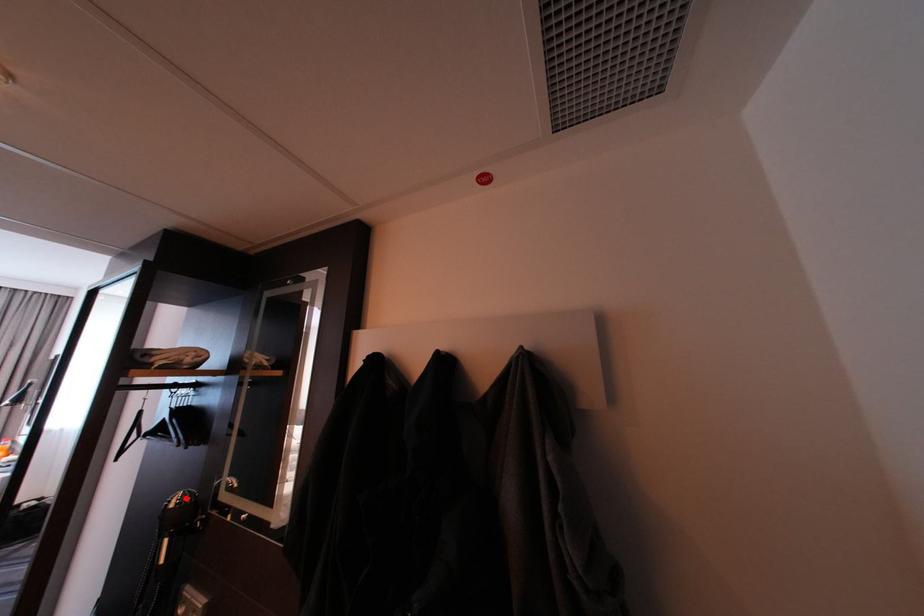
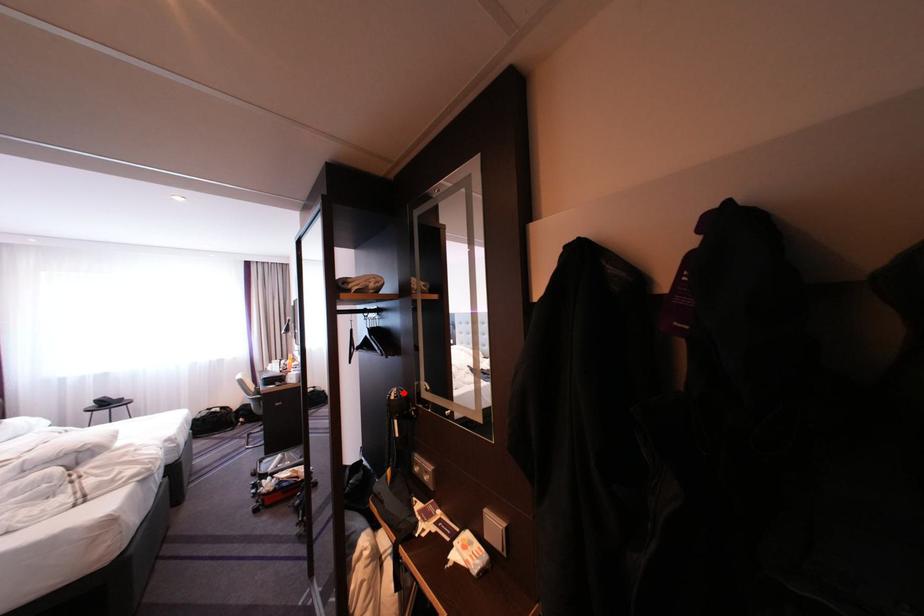
I am providing you with two images of the same scene from different viewpoints. A red point is marked on the first image and another point is marked on the second image. Is the red point in image1 aligned with the point shown in image2?

Yes